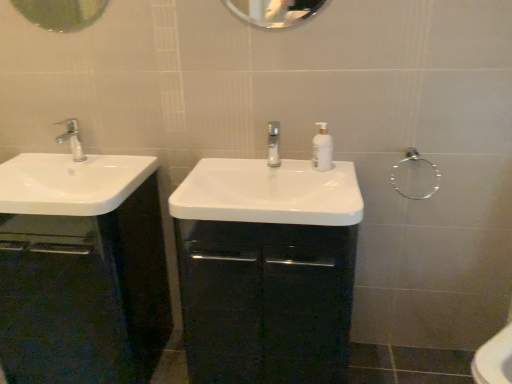
Find the location of a particular element. This screenshot has width=512, height=384. blank space to the left of clear glass tap at center, the 1th tap from the right is located at coordinates (228, 181).